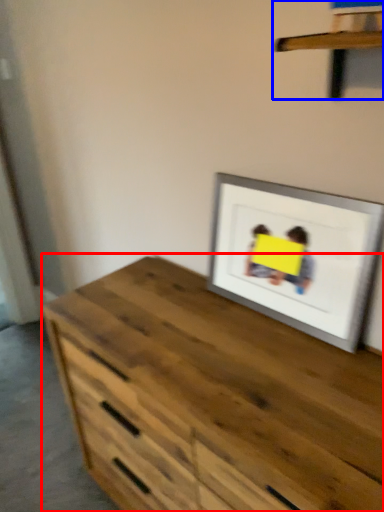
Question: Which object appears closest to the camera in this image, chest of drawers (highlighted by a red box) or shelf (highlighted by a blue box)?

Choices:
 (A) chest of drawers
 (B) shelf

Answer: (B)